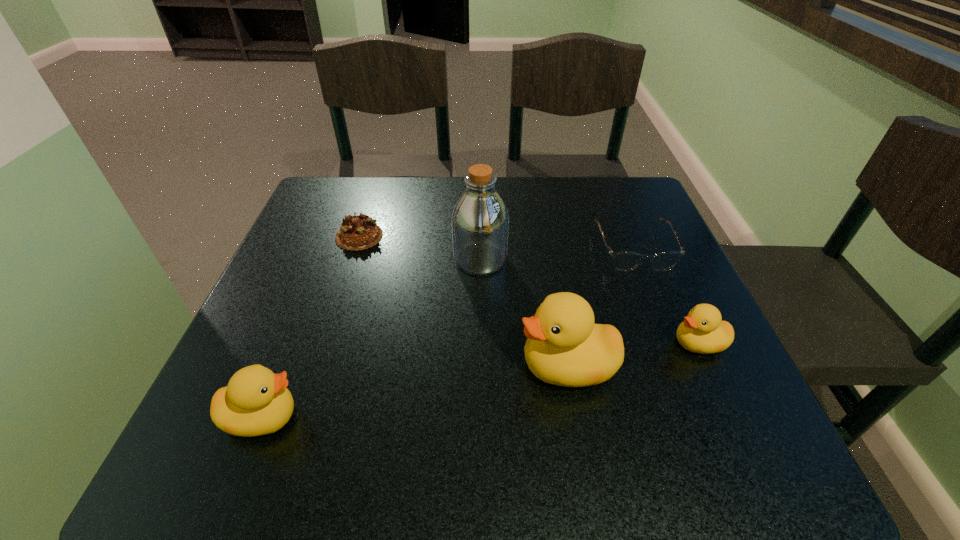
Where is `chocolate cake located in the far edge section of the desktop`? chocolate cake located in the far edge section of the desktop is located at coordinates (359, 232).

Where is `spectacles that is at the far edge`? spectacles that is at the far edge is located at coordinates click(624, 261).

Identify the location of duckling that is at the left edge. The width and height of the screenshot is (960, 540). (256, 402).

This screenshot has width=960, height=540. Find the location of `chocolate cake that is at the left edge`. chocolate cake that is at the left edge is located at coordinates (359, 232).

The image size is (960, 540). Identify the location of duckling that is at the right edge. (702, 331).

Where is `spectacles situated at the right edge`? spectacles situated at the right edge is located at coordinates (624, 261).

At what (x,y) coordinates should I click in order to perform the action: click on object that is at the far left corner. Please return your answer as a coordinate pair (x, y). Image resolution: width=960 pixels, height=540 pixels. Looking at the image, I should click on (359, 232).

Where is `object that is at the near left corner`? object that is at the near left corner is located at coordinates (256, 402).

You are a GUI agent. You are given a task and a screenshot of the screen. Output one action in this format:
    pyautogui.click(x=<x>, y=<y>)
    Task: Click on the object at the far right corner
    
    Given the screenshot: What is the action you would take?
    pyautogui.click(x=624, y=261)

In order to click on free region at the far edge in this screenshot , I will do `click(557, 181)`.